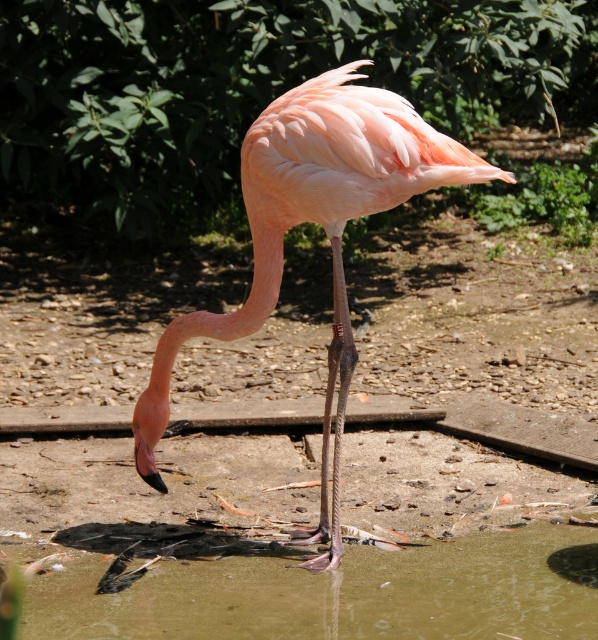
Looking at this image, between greenish water at lower center and pink matte flamingo at center, which one appears on the right side from the viewer's perspective?

greenish water at lower center

Is point (520, 557) less distant than point (389, 202)?

No, (520, 557) is further to viewer.

Who is more distant from viewer, (97, 616) or (341, 204)?

The point (341, 204) is behind.

I want to click on greenish water at lower center, so click(340, 593).